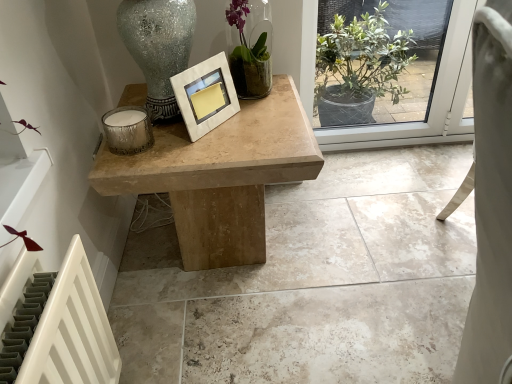
Question: Should I look upward or downward to see green glass vase at upper center?

Choices:
 (A) up
 (B) down

Answer: (A)

Question: Can you confirm if natural wood table at center is wider than natural stone table at center?

Choices:
 (A) no
 (B) yes

Answer: (A)

Question: From the image's perspective, is natural wood table at center above natural stone table at center?

Choices:
 (A) no
 (B) yes

Answer: (B)

Question: Is natural stone table at center at the back of natural wood table at center?

Choices:
 (A) no
 (B) yes

Answer: (A)

Question: From a real-world perspective, is natural wood table at center under natural stone table at center?

Choices:
 (A) no
 (B) yes

Answer: (A)

Question: From the image's perspective, is natural wood table at center beneath natural stone table at center?

Choices:
 (A) yes
 (B) no

Answer: (B)

Question: Considering the relative sizes of natural wood table at center and natural stone table at center in the image provided, is natural wood table at center shorter than natural stone table at center?

Choices:
 (A) no
 (B) yes

Answer: (A)

Question: Is white marble picture frame at center facing away from green glass vase at upper center?

Choices:
 (A) no
 (B) yes

Answer: (A)

Question: Is white marble picture frame at center closer to camera compared to green glass vase at upper center?

Choices:
 (A) yes
 (B) no

Answer: (A)

Question: Is white marble picture frame at center at the left side of green glass vase at upper center?

Choices:
 (A) no
 (B) yes

Answer: (B)

Question: Could you tell me if white marble picture frame at center is facing green glass vase at upper center?

Choices:
 (A) no
 (B) yes

Answer: (A)

Question: Does white marble picture frame at center have a smaller size compared to green glass vase at upper center?

Choices:
 (A) no
 (B) yes

Answer: (B)

Question: Is the surface of white marble picture frame at center in direct contact with green glass vase at upper center?

Choices:
 (A) no
 (B) yes

Answer: (A)

Question: Considering the relative sizes of metallic textured candle at left and natural wood table at center in the image provided, is metallic textured candle at left taller than natural wood table at center?

Choices:
 (A) no
 (B) yes

Answer: (A)